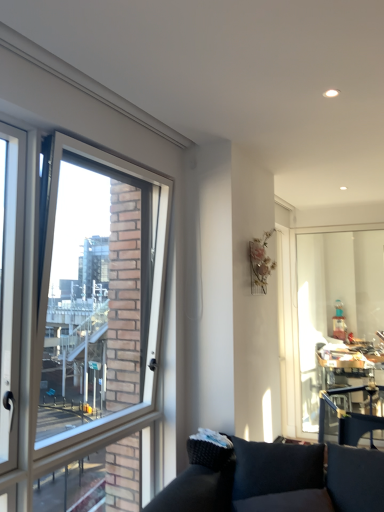
Question: From a real-world perspective, is clear glass window at left physically located above or below transparent glass window screen at right?

Choices:
 (A) above
 (B) below

Answer: (A)

Question: Choose the correct answer: Is clear glass window at left inside transparent glass window screen at right or outside it?

Choices:
 (A) outside
 (B) inside

Answer: (A)

Question: From the image's perspective, relative to transparent glass window screen at right, is clear glass window at left above or below?

Choices:
 (A) below
 (B) above

Answer: (B)

Question: From the image's perspective, relative to clear glass window at left, is transparent glass window screen at right above or below?

Choices:
 (A) below
 (B) above

Answer: (A)

Question: From a real-world perspective, is transparent glass window screen at right positioned above or below clear glass window at left?

Choices:
 (A) above
 (B) below

Answer: (B)

Question: Considering their positions, is transparent glass window screen at right located in front of or behind clear glass window at left?

Choices:
 (A) front
 (B) behind

Answer: (B)

Question: In terms of height, does transparent glass window screen at right look taller or shorter compared to clear glass window at left?

Choices:
 (A) tall
 (B) short

Answer: (B)